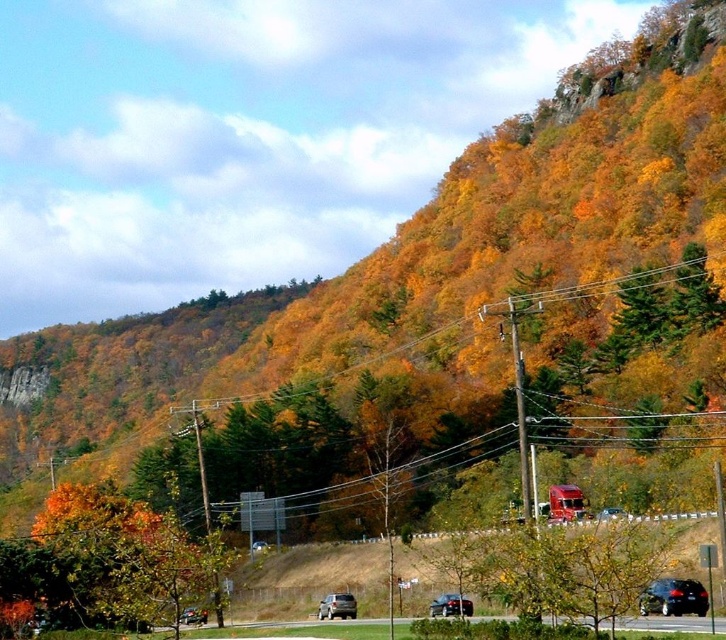
Does metallic wire at upper center have a lesser height compared to shiny black sedan at lower left?

No.

Measure the distance between point (351, 369) and camera.

181.73 meters

Where is `metallic wire at upper center`? metallic wire at upper center is located at coordinates (611, 284).

Can you confirm if orange leafy tree at lower left is taller than shiny black sedan at lower right?

Indeed, orange leafy tree at lower left has a greater height compared to shiny black sedan at lower right.

Based on the photo, between orange leafy tree at lower left and shiny black sedan at lower right, which one is positioned lower?

orange leafy tree at lower left is below.

The width and height of the screenshot is (726, 640). Describe the element at coordinates (110, 560) in the screenshot. I see `orange leafy tree at lower left` at that location.

You are a GUI agent. You are given a task and a screenshot of the screen. Output one action in this format:
    pyautogui.click(x=<x>, y=<y>)
    Task: Click on the orange leafy tree at lower left
    Image resolution: width=726 pixels, height=640 pixels.
    Given the screenshot: What is the action you would take?
    pyautogui.click(x=110, y=560)

Is orange leafy tree at lower left shorter than shiny black sedan at lower center?

In fact, orange leafy tree at lower left may be taller than shiny black sedan at lower center.

The height and width of the screenshot is (640, 726). Describe the element at coordinates (110, 560) in the screenshot. I see `orange leafy tree at lower left` at that location.

Between point (189, 579) and point (469, 600), which one is positioned behind?

Point (469, 600)

You are a GUI agent. You are given a task and a screenshot of the screen. Output one action in this format:
    pyautogui.click(x=<x>, y=<y>)
    Task: Click on the orange leafy tree at lower left
    This screenshot has width=726, height=640.
    Given the screenshot: What is the action you would take?
    pyautogui.click(x=110, y=560)